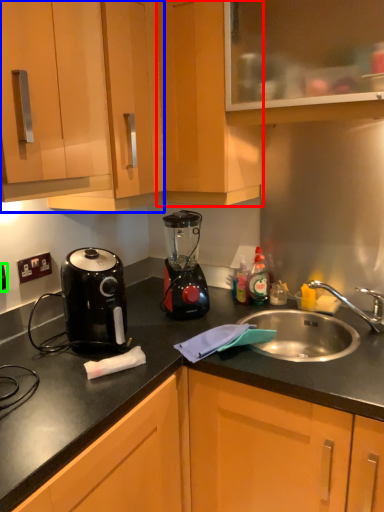
Question: Estimate the real-world distances between objects in this image. Which object is farther from cabinetry (highlighted by a red box), cabinetry (highlighted by a blue box) or electric outlet (highlighted by a green box)?

Choices:
 (A) cabinetry
 (B) electric outlet

Answer: (B)